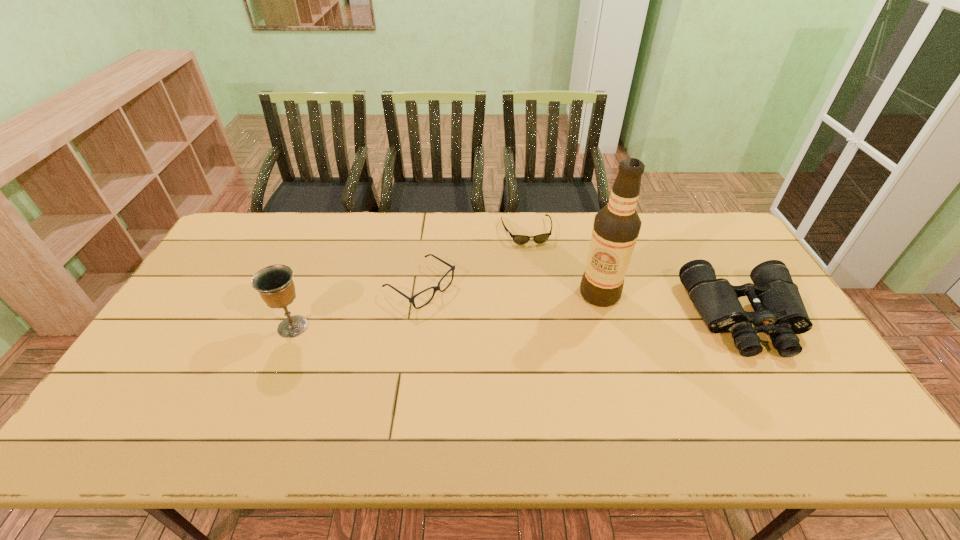
Find the location of a particular element. The image size is (960, 540). vacant area situated 0.170m on the front-facing side of the sunglasses is located at coordinates (540, 280).

This screenshot has height=540, width=960. What are the coordinates of `object located at the far edge` in the screenshot? It's located at pos(541,238).

Find the location of `object that is at the right edge`. object that is at the right edge is located at coordinates (779, 310).

Identify the location of vacant point at the far edge. This screenshot has height=540, width=960. (362, 226).

Identify the location of vacant region at the near edge of the desktop. This screenshot has height=540, width=960. (420, 404).

Find the location of `free space at the left edge of the desktop`. free space at the left edge of the desktop is located at coordinates (164, 346).

Identify the location of blank space at the far left corner of the desktop. (263, 226).

In the image, there is a desktop. Where is `vacant space at the near right corner`? This screenshot has height=540, width=960. vacant space at the near right corner is located at coordinates (807, 390).

Locate an element on the screen. This screenshot has height=540, width=960. blank region between the binoculars and the chalice is located at coordinates (518, 322).

Locate an element on the screen. The image size is (960, 540). vacant area that lies between the third tallest object and the leftmost object is located at coordinates (518, 322).